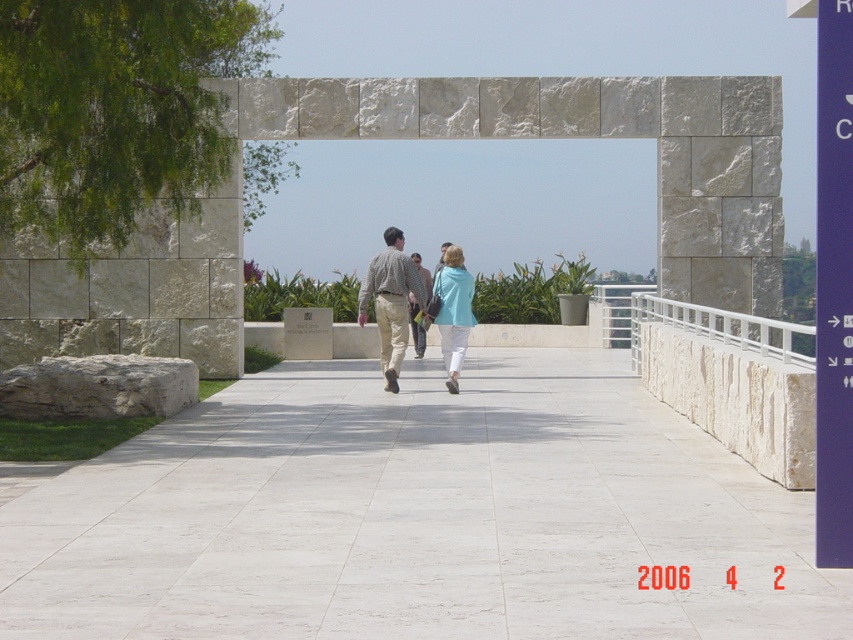
Question: Can you confirm if matte blue sweater at center is positioned to the left of checkered fabric shirt at center?

Choices:
 (A) no
 (B) yes

Answer: (A)

Question: Which of the following is the closest to the observer?

Choices:
 (A) (419, 332)
 (B) (444, 323)
 (C) (444, 404)
 (D) (408, 280)

Answer: (C)

Question: Which point is farther to the camera?

Choices:
 (A) white marble pavement at center
 (B) light brown leather jacket at center
 (C) matte blue sweater at center
 (D) matte khaki pants at center

Answer: (B)

Question: Based on their relative distances, which object is nearer to the matte khaki pants at center?

Choices:
 (A) white marble pavement at center
 (B) light brown leather jacket at center
 (C) matte blue sweater at center
 (D) checkered fabric shirt at center

Answer: (C)

Question: Is matte khaki pants at center closer to the viewer compared to light brown leather jacket at center?

Choices:
 (A) yes
 (B) no

Answer: (A)

Question: Is the position of matte blue sweater at center more distant than that of checkered fabric shirt at center?

Choices:
 (A) no
 (B) yes

Answer: (A)